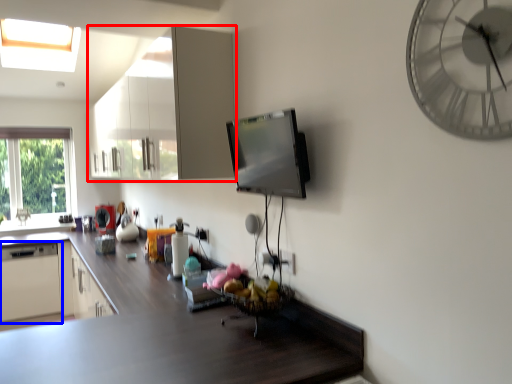
Question: Which point is closer to the camera, cabinetry (highlighted by a red box) or appliance (highlighted by a blue box)?

Choices:
 (A) cabinetry
 (B) appliance

Answer: (A)